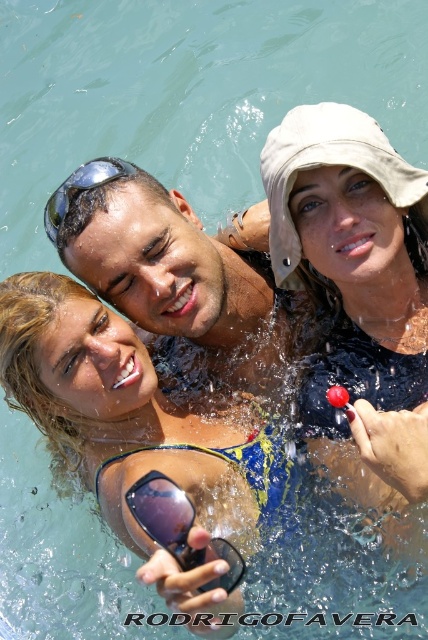
Question: Which object is the closest to the matte black goggles at center?

Choices:
 (A) matte beige hat at upper right
 (B) matte black goggles at upper left

Answer: (A)

Question: Which object is closer to the camera taking this photo?

Choices:
 (A) matte black goggles at center
 (B) matte beige hat at upper right
 (C) matte black goggles at upper left

Answer: (A)

Question: Among these objects, which one is farthest from the camera?

Choices:
 (A) matte skin at center
 (B) matte beige hat at upper right
 (C) matte black goggles at upper left
 (D) matte black goggles at center

Answer: (A)

Question: Is matte beige hat at upper right below matte skin at center?

Choices:
 (A) no
 (B) yes

Answer: (B)

Question: Does matte beige hat at upper right have a smaller size compared to matte skin at center?

Choices:
 (A) no
 (B) yes

Answer: (A)

Question: Is matte beige hat at upper right to the left of matte skin at center from the viewer's perspective?

Choices:
 (A) yes
 (B) no

Answer: (B)